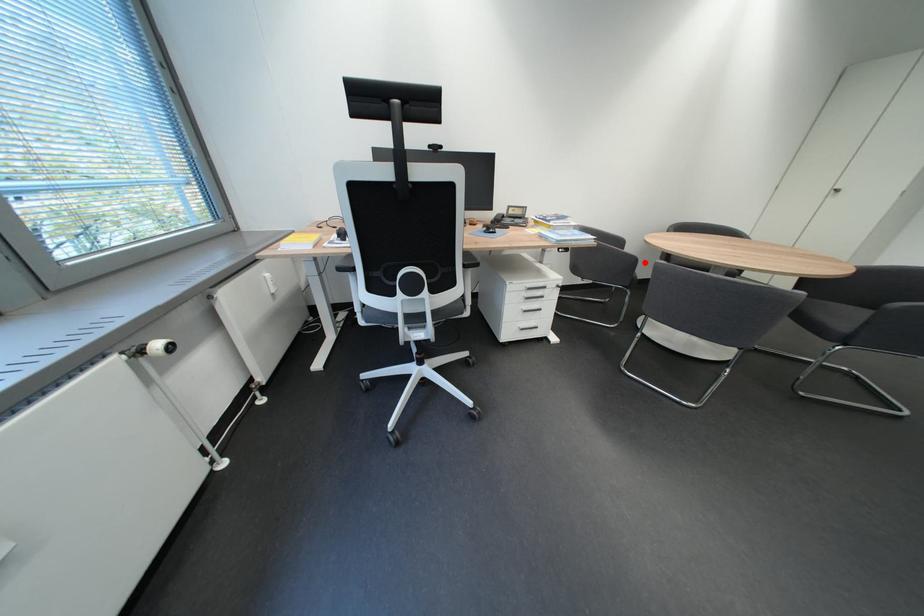
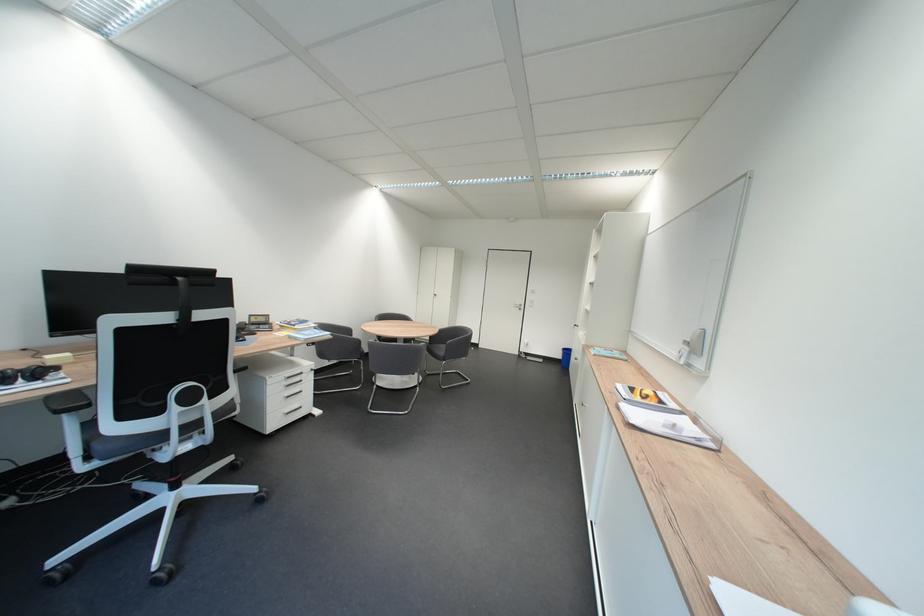
Where in the second image is the point corresponding to the highlighted location from the first image?

(371, 342)